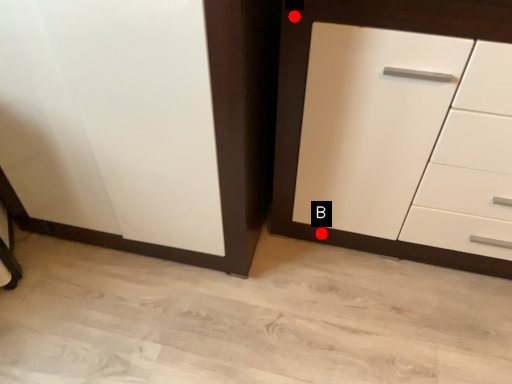
Question: Two points are circled on the image, labeled by A and B beside each circle. Which point is closer to the camera?

Choices:
 (A) A is closer
 (B) B is closer

Answer: (A)